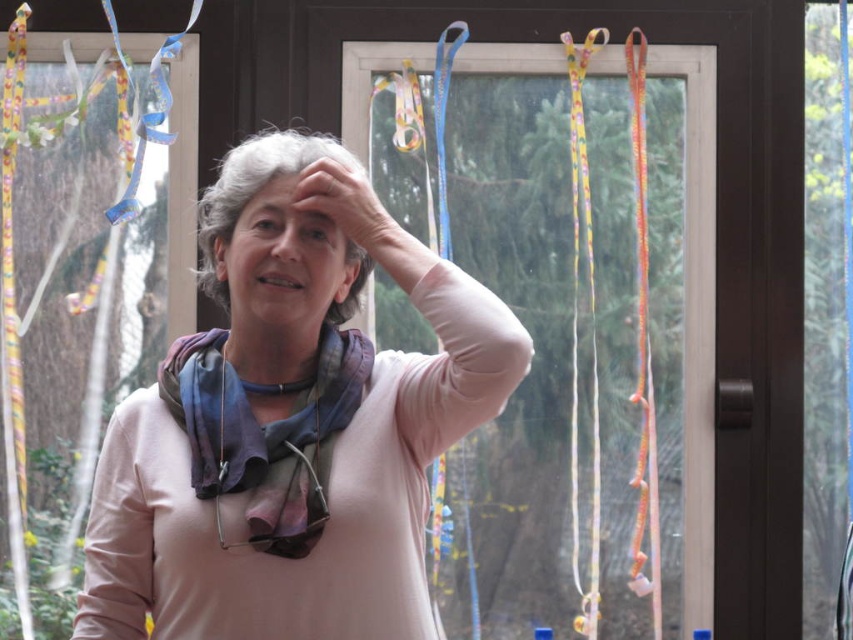
Question: Does pink fabric scarf at center have a larger size compared to matte skin hand at upper center?

Choices:
 (A) yes
 (B) no

Answer: (A)

Question: Which object is positioned closest to the multicolored silk scarf at center?

Choices:
 (A) matte skin hand at upper center
 (B) matte pink sweater at center
 (C) smooth skin at center
 (D) transparent plastic ribbons at upper center

Answer: (B)

Question: Can you confirm if pink fabric scarf at center is positioned to the right of smooth skin at center?

Choices:
 (A) no
 (B) yes

Answer: (B)

Question: Which object is the closest to the matte pink sweater at center?

Choices:
 (A) matte skin hand at upper center
 (B) multicolored silk scarf at center
 (C) smooth skin at center

Answer: (A)

Question: Does transparent plastic ribbons at upper center appear on the left side of matte skin hand at upper center?

Choices:
 (A) yes
 (B) no

Answer: (B)

Question: Which point is farther to the camera?

Choices:
 (A) matte skin hand at upper center
 (B) smooth skin at center
 (C) multicolored silk scarf at center
 (D) transparent plastic ribbons at upper center

Answer: (D)